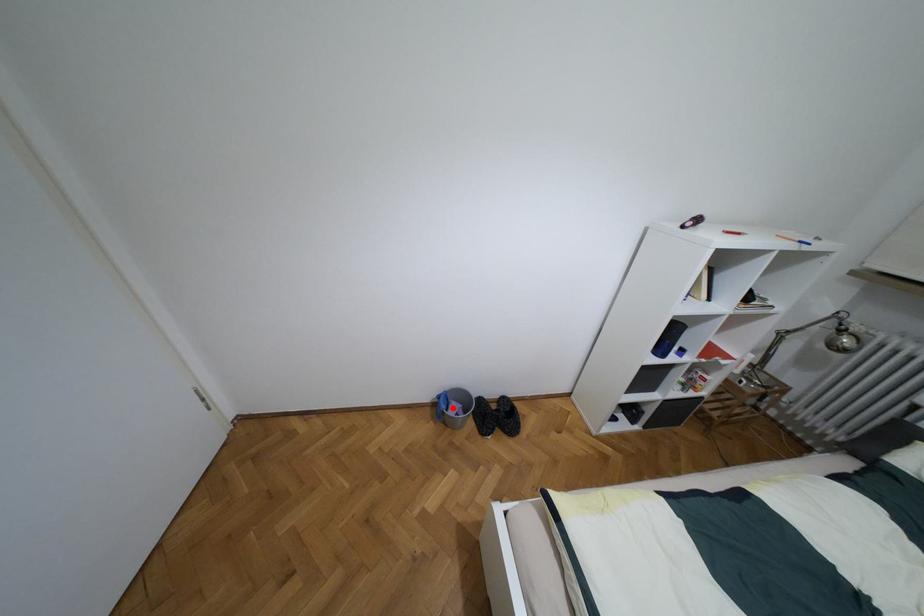
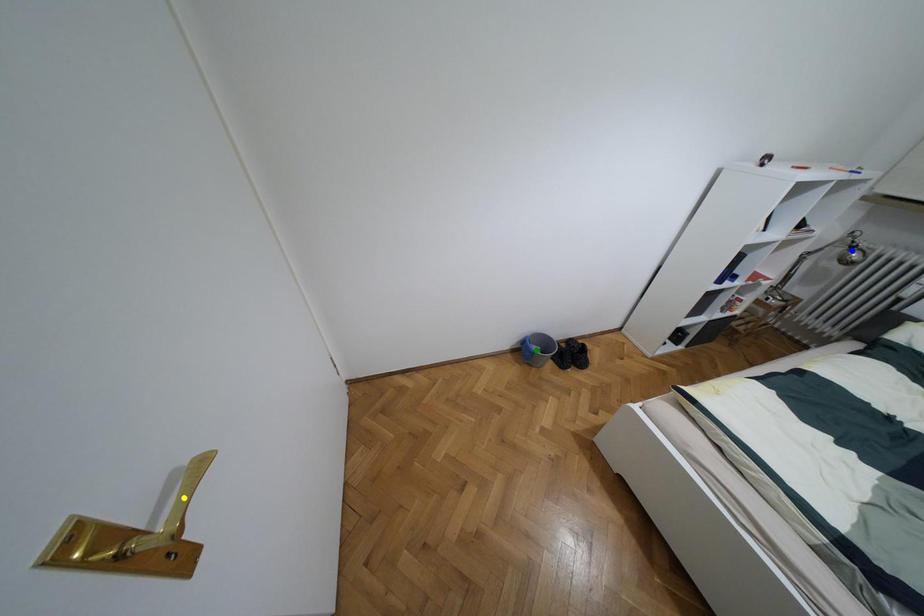
Question: I am providing you with two images of the same scene from different viewpoints. A red point is marked on the first image. You are given multiple points on the second image. Which mark in image 2 goes with the point in image 1?

Choices:
 (A) blue point
 (B) green point
 (C) yellow point

Answer: (B)